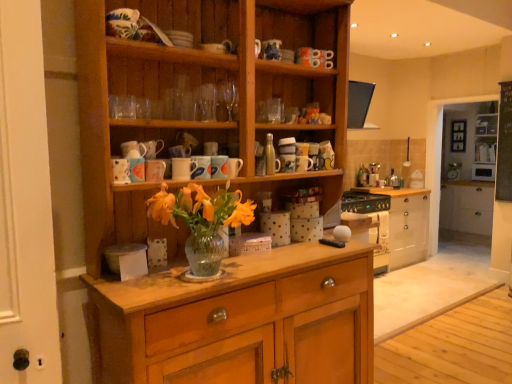
Question: Is point (147, 165) closer or farther from the camera than point (112, 162)?

Choices:
 (A) closer
 (B) farther

Answer: (B)

Question: Is matte ceramic mug at upper center, which ranks as the second mug in left-to-right order, taller or shorter than matte ceramic mug at upper center, acting as the sixth mug starting from the right?

Choices:
 (A) short
 (B) tall

Answer: (A)

Question: Estimate the real-world distances between objects in this image. Which object is farther from the matte ceramic mug at upper center, acting as the sixth mug starting from the right?

Choices:
 (A) wooden cabinet at center
 (B) matte ceramic mug at upper center, which ranks as the second mug in left-to-right order
 (C) white glossy microwave at upper right
 (D) white glossy shelves at upper right, positioned as the second shelf in left-to-right order
 (E) glossy ceramic mug at upper center, the third mug positioned from the right

Answer: (C)

Question: Estimate the real-world distances between objects in this image. Which object is farther from the glossy ceramic mug at upper center, the third mug positioned from the right?

Choices:
 (A) white glossy microwave at upper right
 (B) white glossy shelves at upper right, the first shelf in the right-to-left sequence
 (C) white glossy door at left
 (D) matte ceramic mug at upper center, the 5th mug positioned from the right
 (E) matte ceramic mug at upper center, acting as the sixth mug starting from the right

Answer: (A)